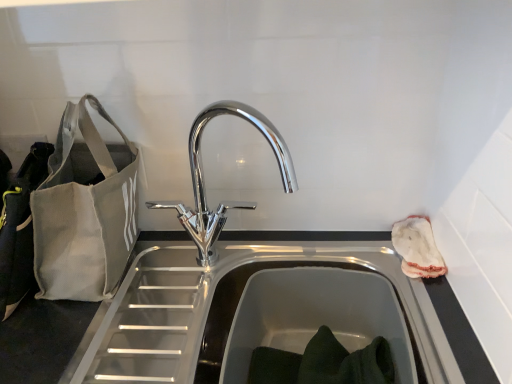
Question: Considering the positions of chrome metallic faucet at center and gray canvas bag at left in the image, is chrome metallic faucet at center bigger or smaller than gray canvas bag at left?

Choices:
 (A) big
 (B) small

Answer: (B)

Question: Is chrome metallic faucet at center situated inside gray canvas bag at left or outside?

Choices:
 (A) inside
 (B) outside

Answer: (B)

Question: Estimate the real-world distances between objects in this image. Which object is closer to the gray canvas bag at left?

Choices:
 (A) white fabric pouch at right
 (B) chrome metallic faucet at center

Answer: (B)

Question: Which object is the closest to the chrome metallic faucet at center?

Choices:
 (A) white fabric pouch at right
 (B) gray canvas bag at left

Answer: (B)